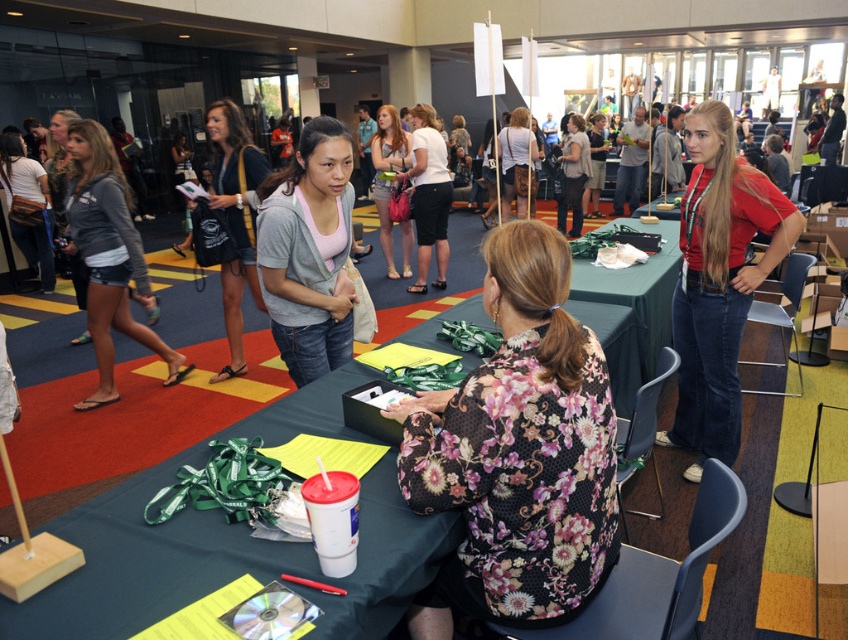
You are attending an event and need to choose between two shirts displayed at the registration booth. The gray cotton shirt at center and the matte white shirt at center are both available. If you want to pick the smaller one, which should you choose?

The gray cotton shirt at center is smaller than the matte white shirt at center, so you should choose the gray cotton shirt at center.